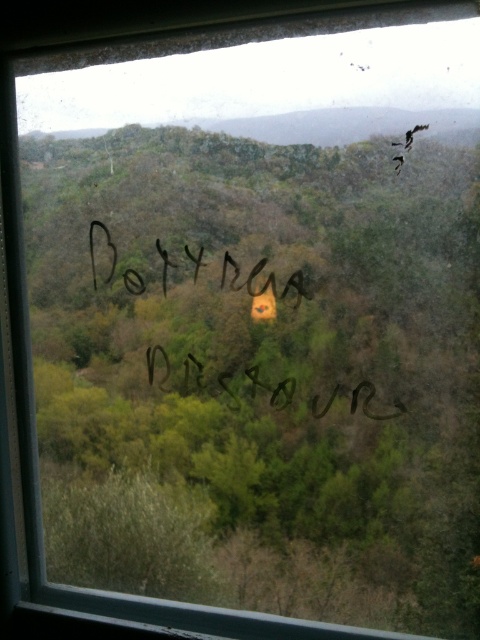
Which of these two, black ink writing at center or black marker writing at center, stands taller?

With more height is black marker writing at center.

In the scene shown: Measure the distance between point (x=277, y=396) and camera.

Point (x=277, y=396) and camera are 1.32 meters apart.

This screenshot has width=480, height=640. What do you see at coordinates (356, 401) in the screenshot?
I see `black ink writing at center` at bounding box center [356, 401].

Identify the location of black ink writing at center. (356, 401).